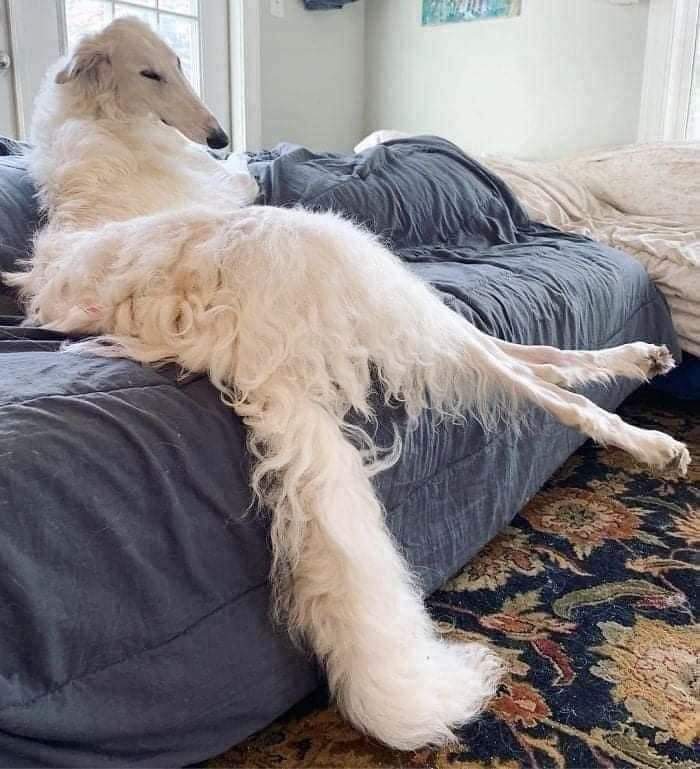
The image size is (700, 769). Find the location of `wall art`. wall art is located at coordinates (463, 2).